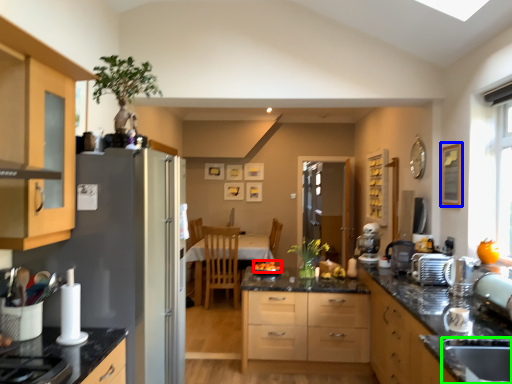
Question: Estimate the real-world distances between objects in this image. Which object is closer to fruit (highlighted by a red box), picture frame (highlighted by a blue box) or sink (highlighted by a green box)?

Choices:
 (A) picture frame
 (B) sink

Answer: (A)